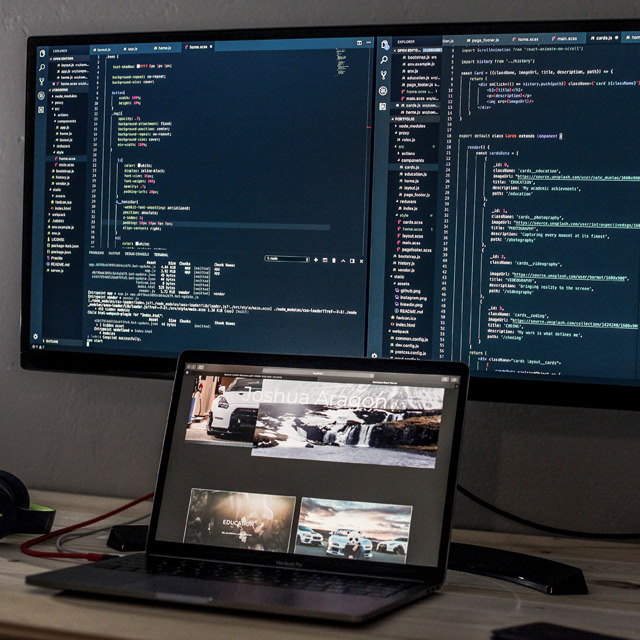
This screenshot has height=640, width=640. Identify the location of screen. (317, 483), (380, 188).